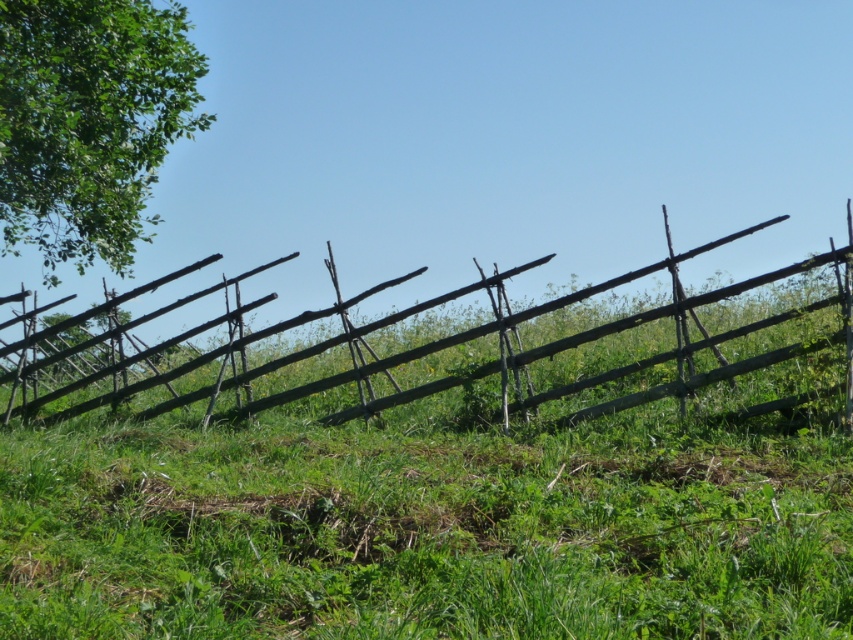
Question: Where is green leafy tree at upper left located in relation to rustic wooden fence at center in the image?

Choices:
 (A) left
 (B) right

Answer: (A)

Question: Does green leafy tree at upper left have a greater width compared to rustic wooden fence at center?

Choices:
 (A) no
 (B) yes

Answer: (A)

Question: Does green leafy tree at upper left have a lesser width compared to rustic wooden fence at center?

Choices:
 (A) yes
 (B) no

Answer: (A)

Question: Which point is farther to the camera?

Choices:
 (A) green leafy tree at upper left
 (B) rustic wooden fence at center

Answer: (A)

Question: Among these points, which one is nearest to the camera?

Choices:
 (A) (15, 392)
 (B) (7, 65)

Answer: (B)

Question: Which point is farther to the camera?

Choices:
 (A) click(218, 323)
 (B) click(16, 148)

Answer: (B)